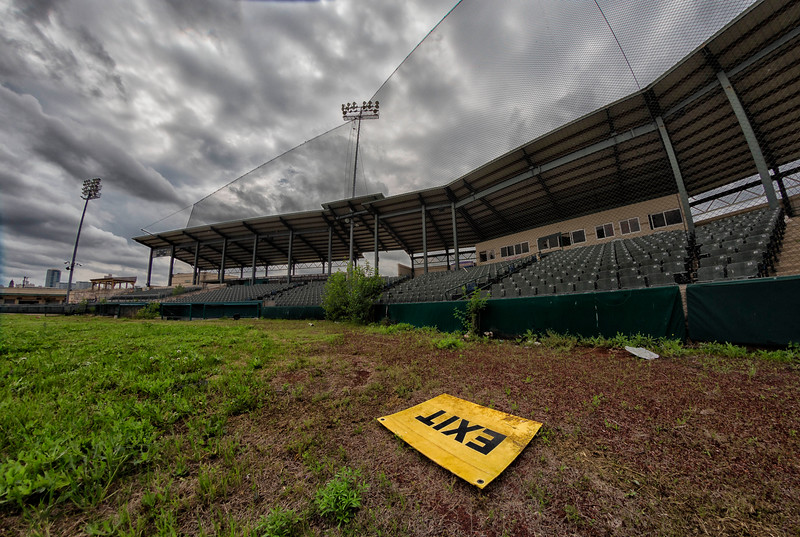
The height and width of the screenshot is (537, 800). Identify the location of exit sign. (x=456, y=456).